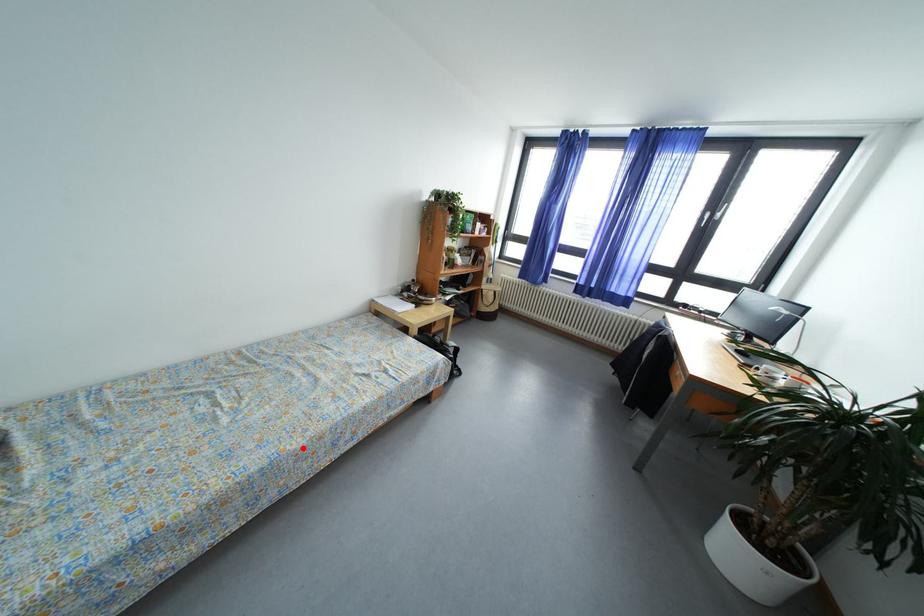
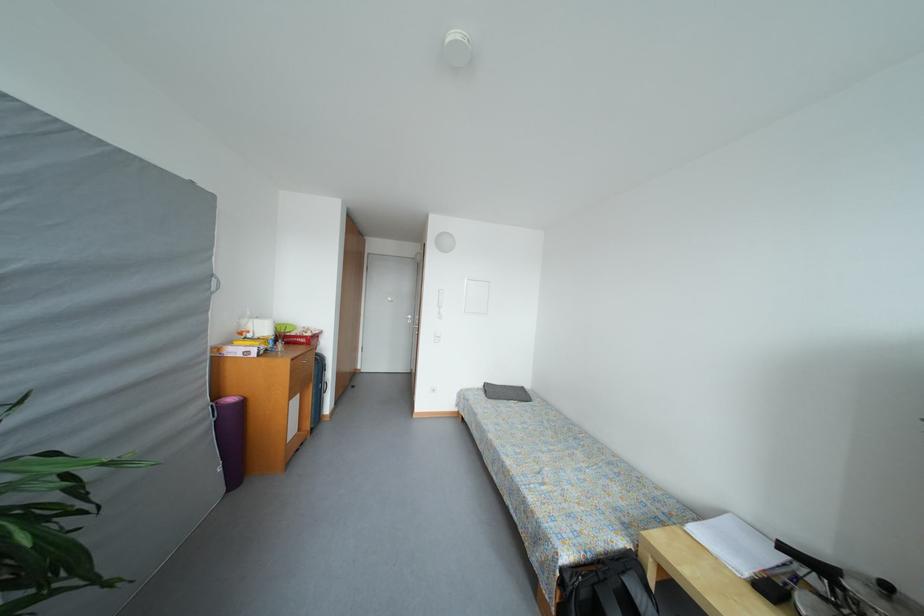
Where in the second image is the point corresponding to the highlighted location from the first image?

(496, 440)